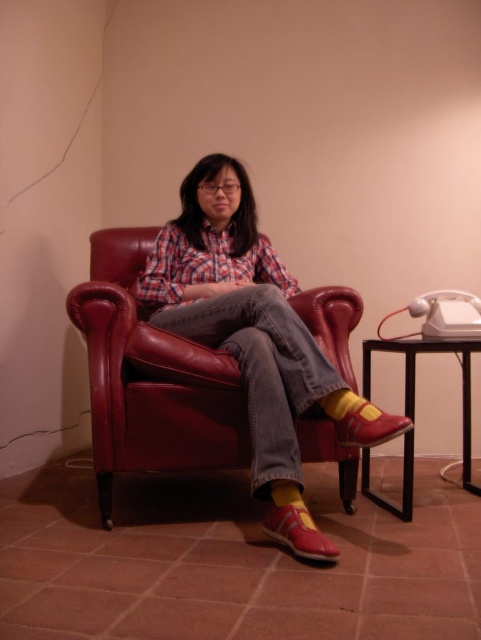
You are a shoe designer examining the image of a person wearing two different red shoes. The shoes are labeled as the matte red shoe at lower center and the shiny red leather shoe at lower right. Which shoe is smaller in size?

The matte red shoe at lower center is smaller in size compared to the shiny red leather shoe at lower right.

You are a delivery robot that is 3 feet wide. You need to move from the entrance to the matte red shoe at lower center. Is there enough space between the entrance and the shoe?

The distance between the entrance and the matte red shoe at lower center is 4.29 feet, so the robot can move through since it is wider than the robot.

You are standing in the room and want to take a photo of the point at coordinates (427, 349). If your camera has a maximum focus range of 1.5 meters, will it be able to focus on that point?

The point at coordinates (427, 349) is 1.71 meters away from the camera, which exceeds the camera maximum focus range of 1.5 meters. Therefore, the camera will not be able to focus on that point.